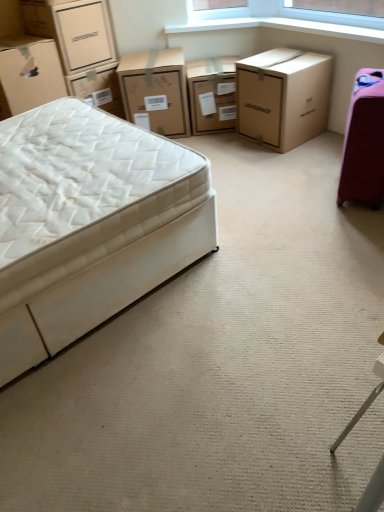
Question: From their relative heights in the image, would you say white fabric bed at left is taller or shorter than matte cardboard box at upper left, positioned as the second box in top-to-bottom order?

Choices:
 (A) tall
 (B) short

Answer: (A)

Question: From a real-world perspective, is white fabric bed at left positioned above or below matte cardboard box at upper left, which appears as the 1th box when ordered from the bottom?

Choices:
 (A) above
 (B) below

Answer: (B)

Question: Which of these objects is positioned closest to the brown cardboard box at upper right, the first chest of drawers when ordered from right to left?

Choices:
 (A) matte cardboard box at upper left, positioned as the second box in top-to-bottom order
 (B) matte cardboard chest of drawers at upper center, positioned as the third chest of drawers in right-to-left order
 (C) matte cardboard chest of drawers at center, which is the 2th chest of drawers in right-to-left order
 (D) matte cardboard box at upper left, arranged as the 1th box when viewed from the top
 (E) white fabric bed at left

Answer: (C)

Question: Which of these objects is positioned farthest from the matte cardboard chest of drawers at upper center, positioned as the third chest of drawers in right-to-left order?

Choices:
 (A) white fabric bed at left
 (B) matte cardboard chest of drawers at center, which is the 2th chest of drawers in right-to-left order
 (C) matte cardboard box at upper left, positioned as the second box in top-to-bottom order
 (D) brown cardboard box at upper right, the first chest of drawers when ordered from right to left
 (E) matte cardboard box at upper left, arranged as the 1th box when viewed from the top

Answer: (A)